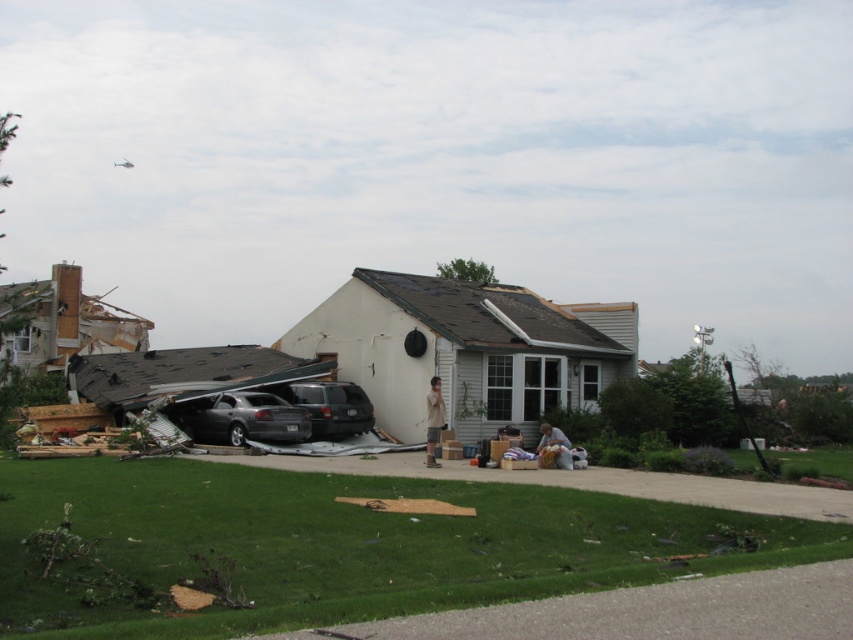
You are a rescue worker assessing the scene from a safe distance. You see the dark gray metallic car at center and the brown cotton shirt at center. Which object is closer to you?

The dark gray metallic car at center is closer to you than the brown cotton shirt at center because it is further to the viewer.

You are a rescue worker trying to access the house after the storm. There is a dark gray metallic car at center blocking the driveway. Can you move the car to clear the path? Provide coordinates if needed.

The dark gray metallic car at center is located at point (242, 419). Moving it would require knowing its exact position, but since coordinates are provided, you can use them to plan the removal.